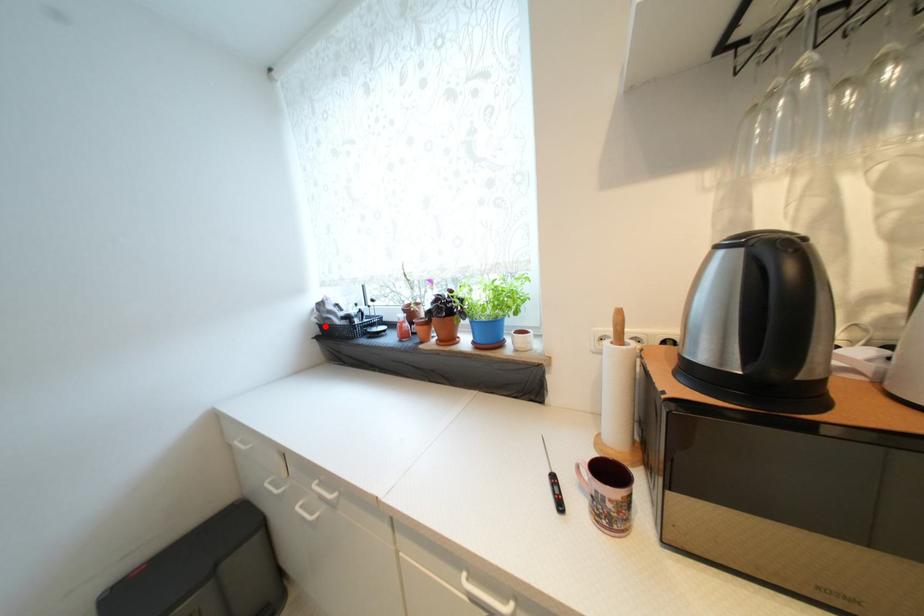
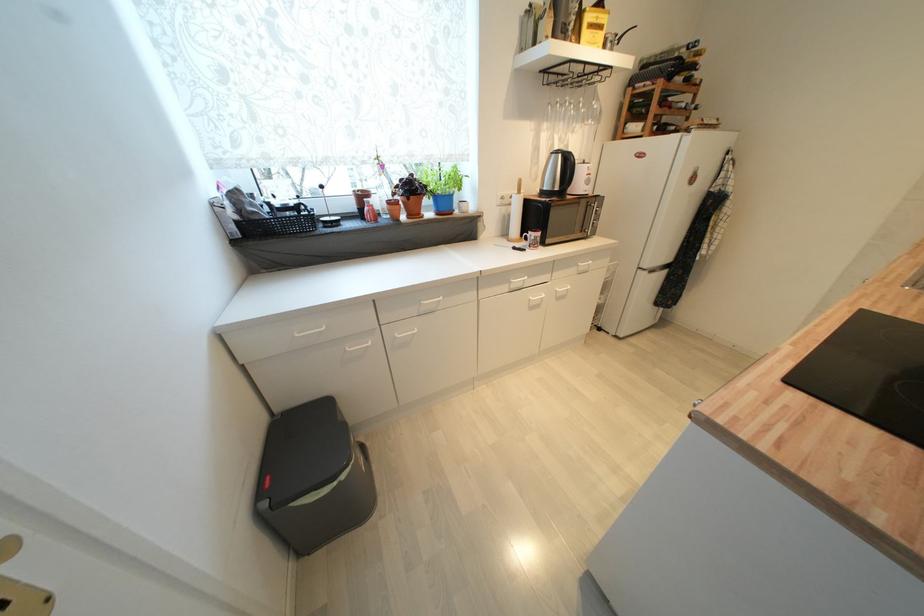
Question: I am providing you with two images of the same scene from different viewpoints. In image1, a red point is highlighted. Considering the same 3D point in image2, which of the following is correct?

Choices:
 (A) It is closer
 (B) It is farther

Answer: (A)